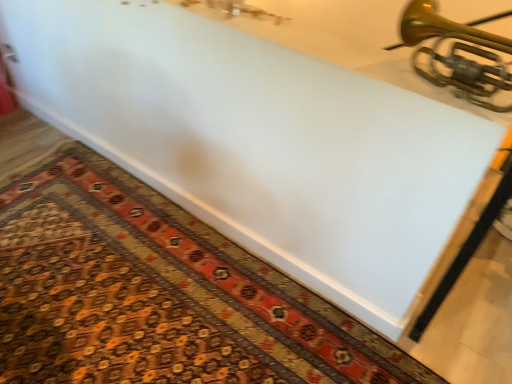
Find the location of `gold brass trumpet at upper right`. gold brass trumpet at upper right is located at coordinates (458, 54).

What do you see at coordinates (458, 54) in the screenshot?
I see `gold brass trumpet at upper right` at bounding box center [458, 54].

Identify the location of carpeted mat at lower center. (157, 294).

Measure the distance between point (x=318, y=332) and camera.

A distance of 1.45 meters exists between point (x=318, y=332) and camera.

Describe the element at coordinates (157, 294) in the screenshot. I see `carpeted mat at lower center` at that location.

The width and height of the screenshot is (512, 384). In order to click on gold brass trumpet at upper right in this screenshot , I will do `click(458, 54)`.

Which is more to the right, carpeted mat at lower center or gold brass trumpet at upper right?

From the viewer's perspective, gold brass trumpet at upper right appears more on the right side.

In the scene shown: Which object is closer to the camera, carpeted mat at lower center or gold brass trumpet at upper right?

gold brass trumpet at upper right is closer to the camera.

Which is farther from the camera, (164, 293) or (480, 36)?

The point (164, 293) is farther.

From the image's perspective, is carpeted mat at lower center located above or below gold brass trumpet at upper right?

Clearly, from the image's perspective, carpeted mat at lower center is below gold brass trumpet at upper right.

From a real-world perspective, does carpeted mat at lower center stand above gold brass trumpet at upper right?

No, from a real-world perspective, carpeted mat at lower center is not on top of gold brass trumpet at upper right.

In the scene shown: Is carpeted mat at lower center thinner than gold brass trumpet at upper right?

No.

Between carpeted mat at lower center and gold brass trumpet at upper right, which one has less height?

carpeted mat at lower center.

Considering the sizes of objects carpeted mat at lower center and gold brass trumpet at upper right in the image provided, who is bigger, carpeted mat at lower center or gold brass trumpet at upper right?

Bigger between the two is carpeted mat at lower center.

Is carpeted mat at lower center located outside gold brass trumpet at upper right?

That's correct, carpeted mat at lower center is outside of gold brass trumpet at upper right.

Is carpeted mat at lower center placed right next to gold brass trumpet at upper right?

carpeted mat at lower center and gold brass trumpet at upper right are not in contact.

Could you tell me if carpeted mat at lower center is turned towards gold brass trumpet at upper right?

No, carpeted mat at lower center does not turn towards gold brass trumpet at upper right.

What's the angular difference between carpeted mat at lower center and gold brass trumpet at upper right's facing directions?

180 degrees.

Measure the distance from carpeted mat at lower center to gold brass trumpet at upper right.

1.08 meters.

At what (x,y) coordinates should I click in order to perform the action: click on musical instrument on the right of the carpeted mat at lower center. Please return your answer as a coordinate pair (x, y). Looking at the image, I should click on (458, 54).

Does gold brass trumpet at upper right appear on the right side of carpeted mat at lower center?

Yes, gold brass trumpet at upper right is to the right of carpeted mat at lower center.

Which is in front, gold brass trumpet at upper right or carpeted mat at lower center?

gold brass trumpet at upper right.

Does point (441, 24) appear closer or farther from the camera than point (225, 367)?

Point (441, 24) appears to be closer to the viewer than point (225, 367).

From the image's perspective, relative to carpeted mat at lower center, is gold brass trumpet at upper right above or below?

Clearly, from the image's perspective, gold brass trumpet at upper right is above carpeted mat at lower center.

From a real-world perspective, who is located lower, gold brass trumpet at upper right or carpeted mat at lower center?

From a 3D spatial view, carpeted mat at lower center is below.

From the picture: Is gold brass trumpet at upper right wider than carpeted mat at lower center?

No, gold brass trumpet at upper right is not wider than carpeted mat at lower center.

Is gold brass trumpet at upper right shorter than carpeted mat at lower center?

In fact, gold brass trumpet at upper right may be taller than carpeted mat at lower center.

Considering the sizes of objects gold brass trumpet at upper right and carpeted mat at lower center in the image provided, who is smaller, gold brass trumpet at upper right or carpeted mat at lower center?

gold brass trumpet at upper right is smaller.

Is gold brass trumpet at upper right spatially inside carpeted mat at lower center, or outside of it?

gold brass trumpet at upper right is located beyond the bounds of carpeted mat at lower center.

Is gold brass trumpet at upper right next to carpeted mat at lower center and touching it?

gold brass trumpet at upper right is not next to carpeted mat at lower center, and they're not touching.

Does gold brass trumpet at upper right turn towards carpeted mat at lower center?

No.

Can you tell me how much gold brass trumpet at upper right and carpeted mat at lower center differ in facing direction?

They differ by 180 degrees in their facing directions.

The image size is (512, 384). I want to click on mat that is below the gold brass trumpet at upper right (from the image's perspective), so click(157, 294).

You are a GUI agent. You are given a task and a screenshot of the screen. Output one action in this format:
    pyautogui.click(x=<x>, y=<y>)
    Task: Click on the mat lying on the left of gold brass trumpet at upper right
    
    Given the screenshot: What is the action you would take?
    pyautogui.click(x=157, y=294)

The width and height of the screenshot is (512, 384). I want to click on mat located below the gold brass trumpet at upper right (from the image's perspective), so click(157, 294).